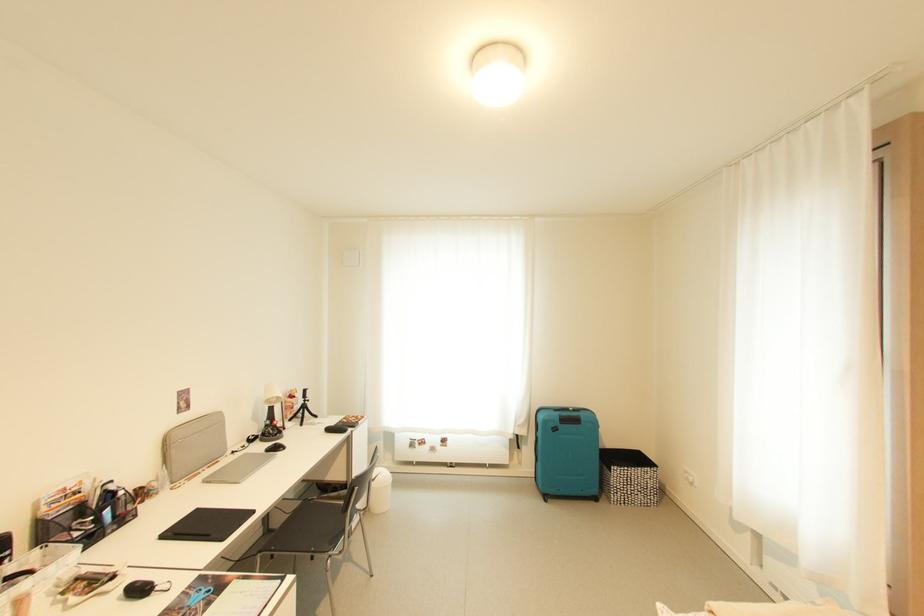
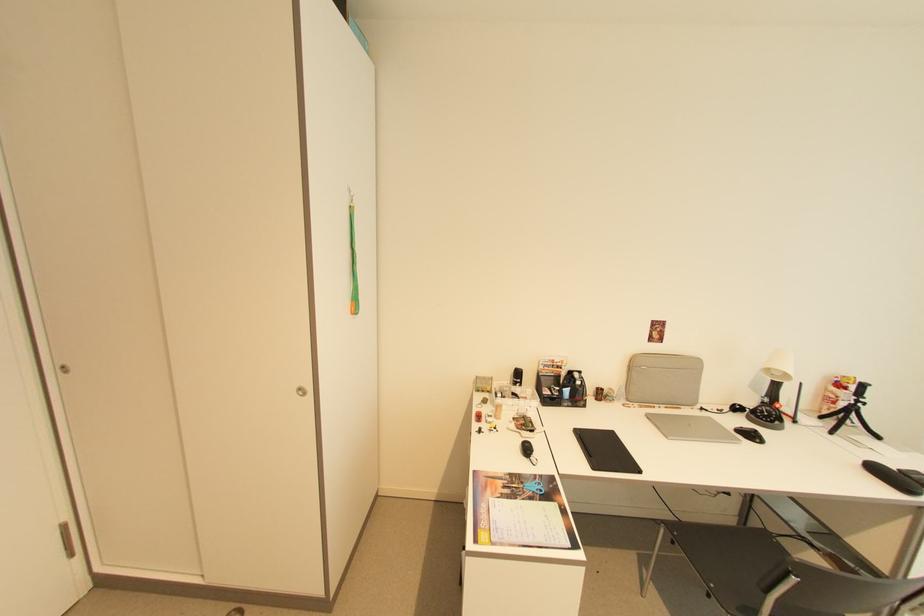
Find the pixel in the second image that matches point (286, 450) in the first image.

(762, 442)